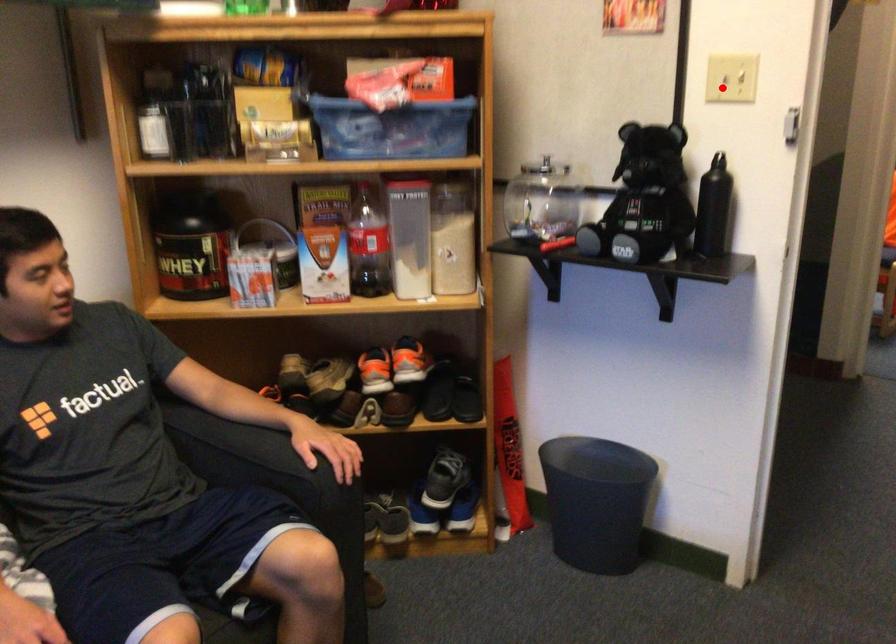
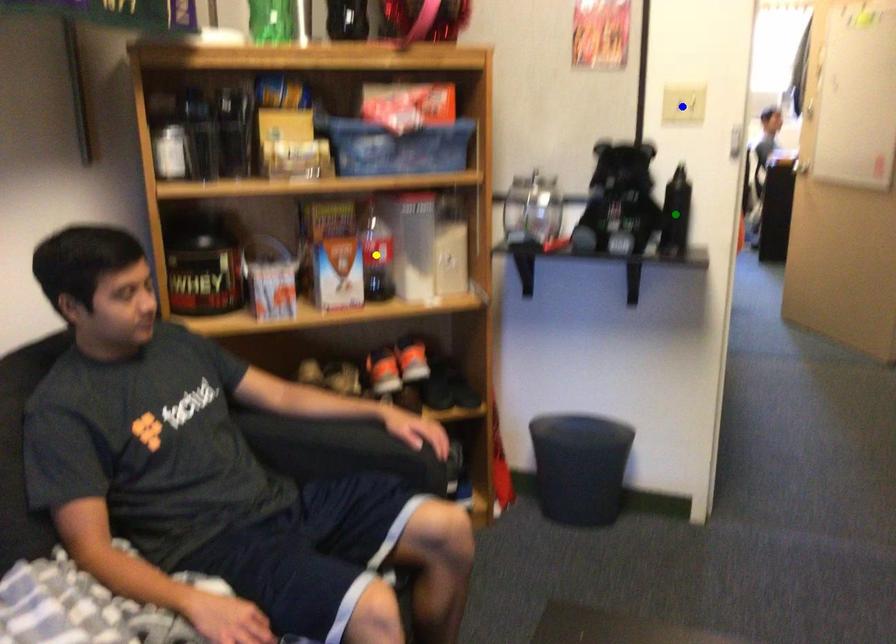
Question: I am providing you with two images of the same scene from different viewpoints. A red point is marked on the first image. You are given multiple points on the second image. Which mark in image 2 goes with the point in image 1?

Choices:
 (A) green point
 (B) yellow point
 (C) blue point

Answer: (C)